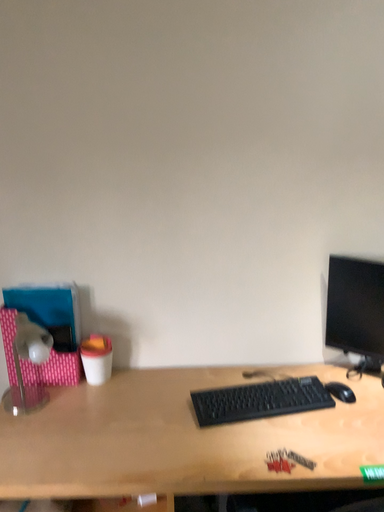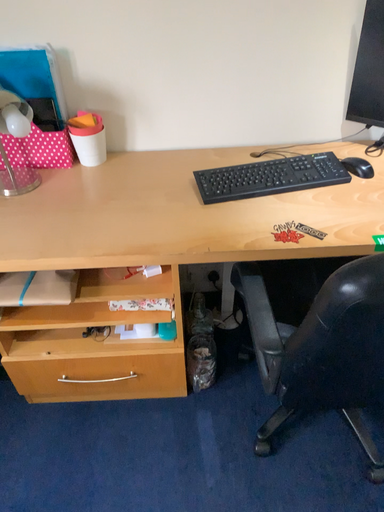
Question: Which way did the camera rotate in the video?

Choices:
 (A) rotated downward
 (B) rotated upward

Answer: (A)